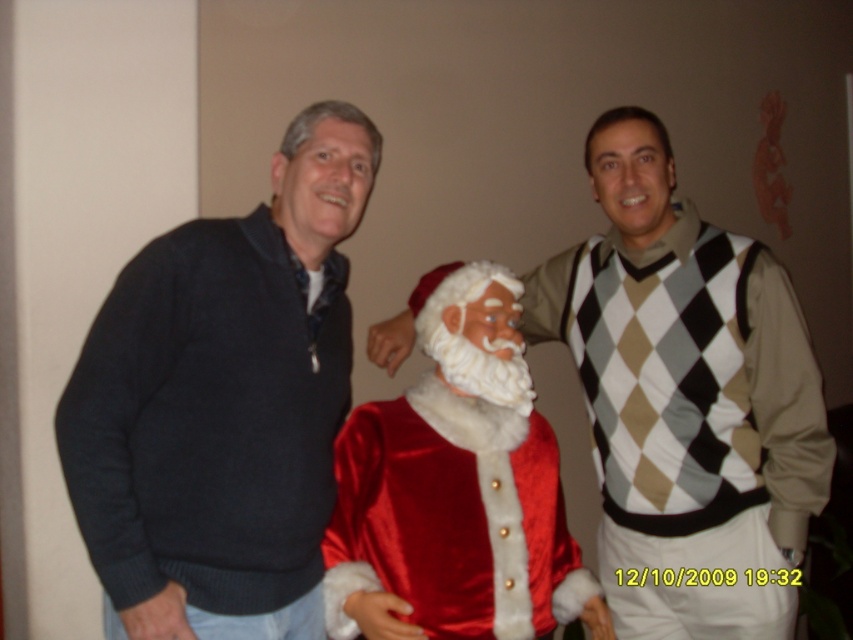
Is dark gray sweater at left further to the viewer compared to velvet santa claus at center?

No.

Does dark gray sweater at left come in front of velvet santa claus at center?

Yes, it is in front of velvet santa claus at center.

Does point (306, 458) come closer to viewer compared to point (345, 456)?

Yes, point (306, 458) is closer to viewer.

Where is `dark gray sweater at left`? The height and width of the screenshot is (640, 853). dark gray sweater at left is located at coordinates (223, 403).

Does dark gray sweater at left appear under satin santa at center?

Incorrect, dark gray sweater at left is not positioned below satin santa at center.

Does dark gray sweater at left have a lesser width compared to satin santa at center?

Yes, dark gray sweater at left is thinner than satin santa at center.

Does point (357, 109) come behind point (672, 195)?

No, (357, 109) is in front of (672, 195).

Find the location of a particular element. dark gray sweater at left is located at coordinates (223, 403).

Does satin santa at center appear under velvet santa claus at center?

No.

This screenshot has height=640, width=853. What do you see at coordinates (683, 368) in the screenshot?
I see `satin santa at center` at bounding box center [683, 368].

This screenshot has height=640, width=853. I want to click on satin santa at center, so click(683, 368).